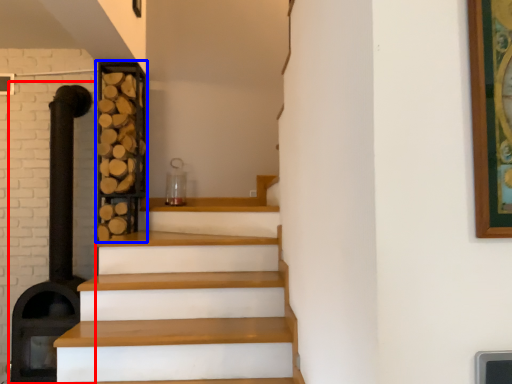
Question: Which of the following is the closest to the observer, fireplace (highlighted by a red box) or shelf (highlighted by a blue box)?

Choices:
 (A) fireplace
 (B) shelf

Answer: (A)